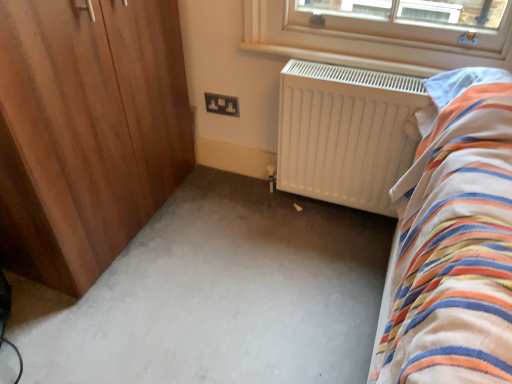
What do you see at coordinates (346, 133) in the screenshot? I see `white matte radiator at center` at bounding box center [346, 133].

Find the location of a particular element. Image resolution: width=512 pixels, height=384 pixels. wooden wardrobe at left is located at coordinates (87, 132).

Where is `black plastic socket at center`? black plastic socket at center is located at coordinates (222, 104).

Which is farther from the camera, (x=127, y=304) or (x=322, y=121)?

Positioned behind is point (x=322, y=121).

From the image's perspective, is white carpet at center positioned above or below white matte radiator at center?

Clearly, from the image's perspective, white carpet at center is below white matte radiator at center.

In terms of height, does white carpet at center look taller or shorter compared to white matte radiator at center?

Considering their sizes, white carpet at center has less height than white matte radiator at center.

Is white matte radiator at center completely or partially outside of wooden wardrobe at left?

Absolutely, white matte radiator at center is external to wooden wardrobe at left.

From the picture: Does white matte radiator at center have a lesser height compared to wooden wardrobe at left?

Yes, white matte radiator at center is shorter than wooden wardrobe at left.

From a real-world perspective, which object stands above the other?

wooden wardrobe at left.

Based on the photo, can you confirm if white matte radiator at center is bigger than wooden wardrobe at left?

Actually, white matte radiator at center might be smaller than wooden wardrobe at left.

From the picture: Is black plastic socket at center taller or shorter than white carpet at center?

Considering their sizes, black plastic socket at center has more height than white carpet at center.

From the image's perspective, is black plastic socket at center beneath white carpet at center?

No, from the image's perspective, black plastic socket at center is not beneath white carpet at center.

Considering the positions of objects black plastic socket at center and white carpet at center in the image provided, who is more to the right, black plastic socket at center or white carpet at center?

white carpet at center.

Is wooden wardrobe at left not near white matte radiator at center?

wooden wardrobe at left is actually quite close to white matte radiator at center.

Relative to white matte radiator at center, is wooden wardrobe at left in front or behind?

In the image, wooden wardrobe at left appears in front of white matte radiator at center.

From the picture: Considering the relative positions of wooden wardrobe at left and white matte radiator at center in the image provided, is wooden wardrobe at left to the right of white matte radiator at center from the viewer's perspective?

In fact, wooden wardrobe at left is to the left of white matte radiator at center.

Is wooden wardrobe at left aimed at white matte radiator at center?

Yes, wooden wardrobe at left is turned towards white matte radiator at center.

Consider the image. How much distance is there between white matte radiator at center and white carpet at center?

white matte radiator at center is 43.42 centimeters from white carpet at center.

Is white matte radiator at center positioned with its back to white carpet at center?

That's not correct — white matte radiator at center is not looking away from white carpet at center.

Consider the image. From the image's perspective, is white matte radiator at center above white carpet at center?

Correct, white matte radiator at center appears higher than white carpet at center in the image.

Could black plastic socket at center be considered to be inside white carpet at center?

No, black plastic socket at center is not a part of white carpet at center.

From a real-world perspective, relative to black plastic socket at center, is white carpet at center vertically above or below?

white carpet at center is below black plastic socket at center.

Can you confirm if white carpet at center is thinner than black plastic socket at center?

In fact, white carpet at center might be wider than black plastic socket at center.

From the image's perspective, would you say white carpet at center is positioned over black plastic socket at center?

No, from the image's perspective, white carpet at center is not on top of black plastic socket at center.

What's the angular difference between wooden wardrobe at left and white carpet at center's facing directions?

They differ by 90.1 degrees in their facing directions.

In the image, there is a white carpet at center. Where is `door above it (from the image's perspective)`? The image size is (512, 384). door above it (from the image's perspective) is located at coordinates (87, 132).

Could you tell me if wooden wardrobe at left is turned towards white carpet at center?

Yes, wooden wardrobe at left is turned towards white carpet at center.

Can we say wooden wardrobe at left lies outside white carpet at center?

Yes.

At what (x,y) coordinates should I click in order to perform the action: click on plain on the left of white matte radiator at center. Please return your answer as a coordinate pair (x, y). Looking at the image, I should click on (218, 295).

At what (x,y) coordinates should I click in order to perform the action: click on radiator behind the wooden wardrobe at left. Please return your answer as a coordinate pair (x, y). The height and width of the screenshot is (384, 512). Looking at the image, I should click on (346, 133).

Considering their positions, is wooden wardrobe at left positioned further to black plastic socket at center than white matte radiator at center?

wooden wardrobe at left is positioned further to the anchor black plastic socket at center.

Which object lies further to the anchor point wooden wardrobe at left, white carpet at center or black plastic socket at center?

black plastic socket at center lies further to wooden wardrobe at left than the other object.

From the image, which object appears to be nearer to white matte radiator at center, wooden wardrobe at left or white carpet at center?

The object closer to white matte radiator at center is white carpet at center.

Estimate the real-world distances between objects in this image. Which object is further from white matte radiator at center, white carpet at center or black plastic socket at center?

black plastic socket at center lies further to white matte radiator at center than the other object.

From the image, which object appears to be farther from black plastic socket at center, white matte radiator at center or wooden wardrobe at left?

Among the two, wooden wardrobe at left is located further to black plastic socket at center.

Looking at the image, which one is located further to black plastic socket at center, wooden wardrobe at left or white carpet at center?

The object further to black plastic socket at center is white carpet at center.

Which object lies nearer to the anchor point wooden wardrobe at left, white matte radiator at center or black plastic socket at center?

black plastic socket at center is closer to wooden wardrobe at left.

From the image, which object appears to be nearer to white carpet at center, black plastic socket at center or white matte radiator at center?

The object closer to white carpet at center is white matte radiator at center.

This screenshot has width=512, height=384. I want to click on plain between wooden wardrobe at left and white matte radiator at center from left to right, so click(218, 295).

Find the location of a particular element. The width and height of the screenshot is (512, 384). radiator between white carpet at center and black plastic socket at center along the z-axis is located at coordinates (346, 133).

This screenshot has height=384, width=512. What are the coordinates of `plain between wooden wardrobe at left and black plastic socket at center along the z-axis` in the screenshot? It's located at (218, 295).

You are a GUI agent. You are given a task and a screenshot of the screen. Output one action in this format:
    pyautogui.click(x=<x>, y=<y>)
    Task: Click on the electric outlet situated between wooden wardrobe at left and white matte radiator at center from left to right
    This screenshot has height=384, width=512.
    Given the screenshot: What is the action you would take?
    pyautogui.click(x=222, y=104)